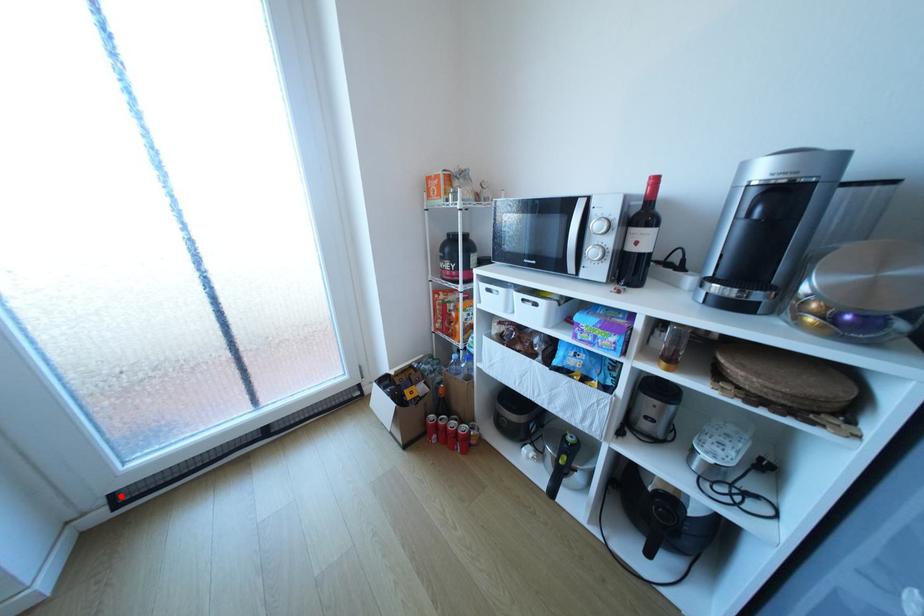
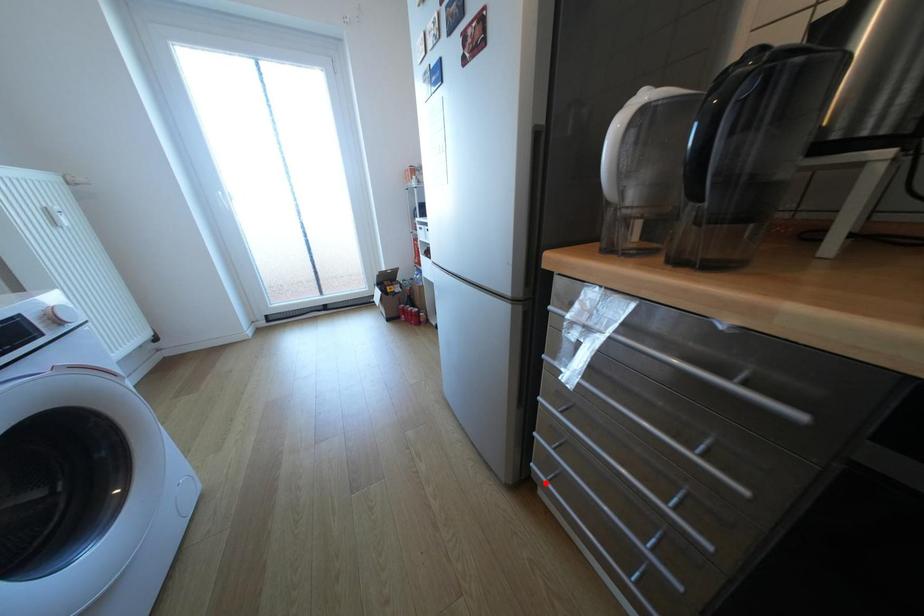
I am providing you with two images of the same scene from different viewpoints. A red point is marked on the first image and another point is marked on the second image. Is the red point in image1 aligned with the point shown in image2?

No